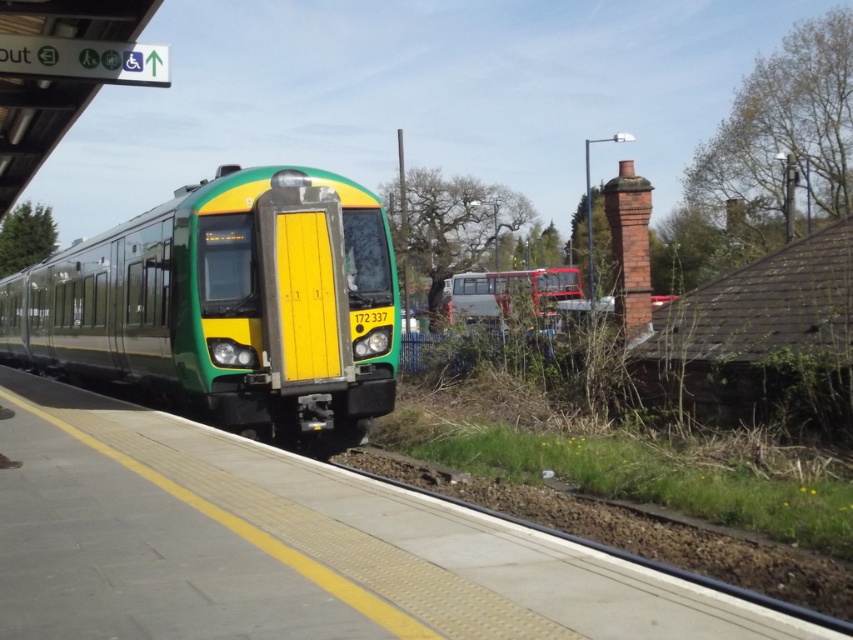
Question: Which of these objects is positioned closest to the brown gravel train track at lower center?

Choices:
 (A) green matte train at center
 (B) concrete platform at center
 (C) metallic silver bus at center

Answer: (B)

Question: Can you confirm if brown gravel train track at lower center is bigger than metallic silver bus at center?

Choices:
 (A) no
 (B) yes

Answer: (A)

Question: From the image, what is the correct spatial relationship of brown gravel train track at lower center in relation to metallic silver bus at center?

Choices:
 (A) above
 (B) below

Answer: (B)

Question: Which point is closer to the camera?

Choices:
 (A) (186, 634)
 (B) (325, 452)
 (C) (608, 554)

Answer: (A)

Question: From the image, what is the correct spatial relationship of green matte train at center in relation to brown gravel train track at lower center?

Choices:
 (A) above
 (B) below

Answer: (A)

Question: Which object is the farthest from the metallic silver bus at center?

Choices:
 (A) brown gravel train track at lower center
 (B) concrete platform at center

Answer: (A)